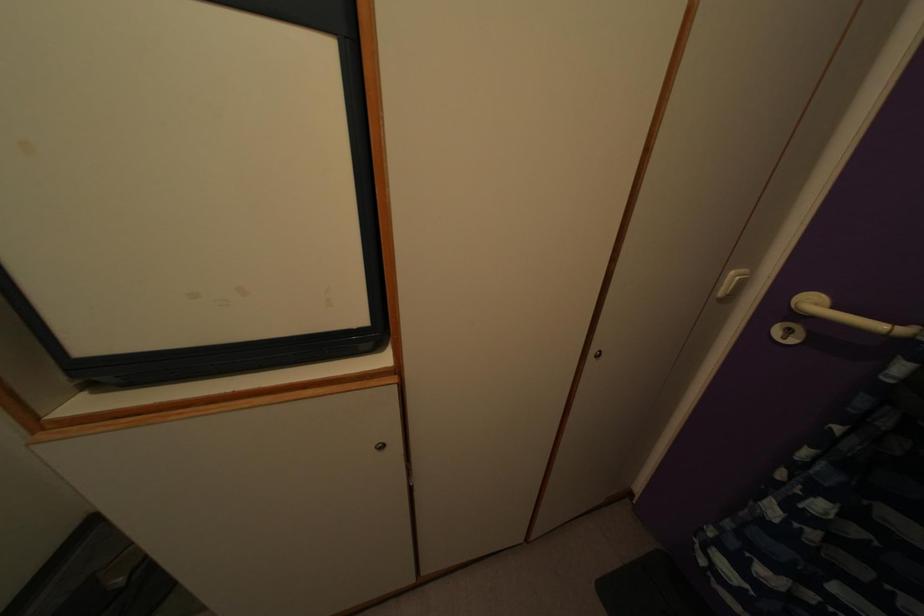
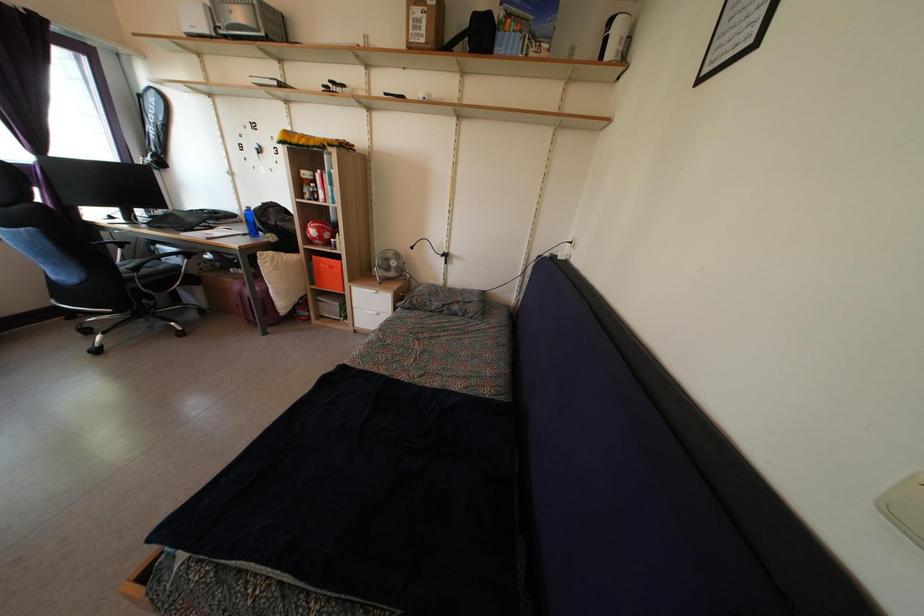
Question: What movement of the cameraman would produce the second image?

Choices:
 (A) Left
 (B) Right
 (C) Forward
 (D) Backward

Answer: (A)